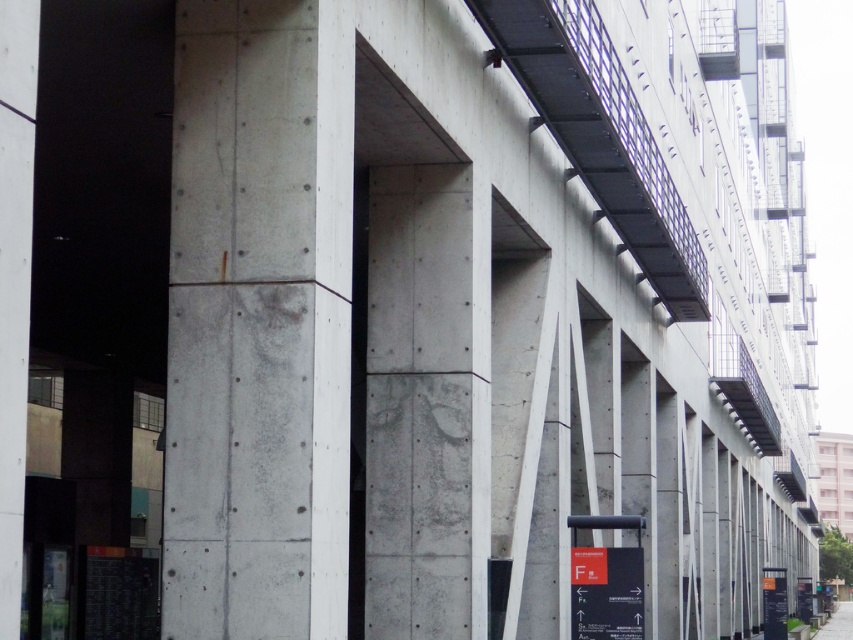
You are standing in front of the modern architectural structure. You notice the gray concrete pillar at center and the gray concrete pavement at lower right. Which object is shorter in height?

The gray concrete pillar at center is not as tall as the gray concrete pavement at lower right, so the gray concrete pillar at center is shorter in height.

You are an architect planning to install a new lighting system. You need to place a spotlight on the smooth black metal overpass at upper center and a floodlight on the gray concrete pavement at lower right. Considering their sizes, which object will require a larger base for its fixture?

The gray concrete pavement at lower right requires a larger base because the smooth black metal overpass at upper center is smaller in size compared to it.

You are standing at the point marked by the coordinates point [259,321] in the image. What object is directly beneath your feet?

The point [259,321] indicates the gray concrete pillar at center, so the object directly beneath your feet is the gray concrete pillar at center.